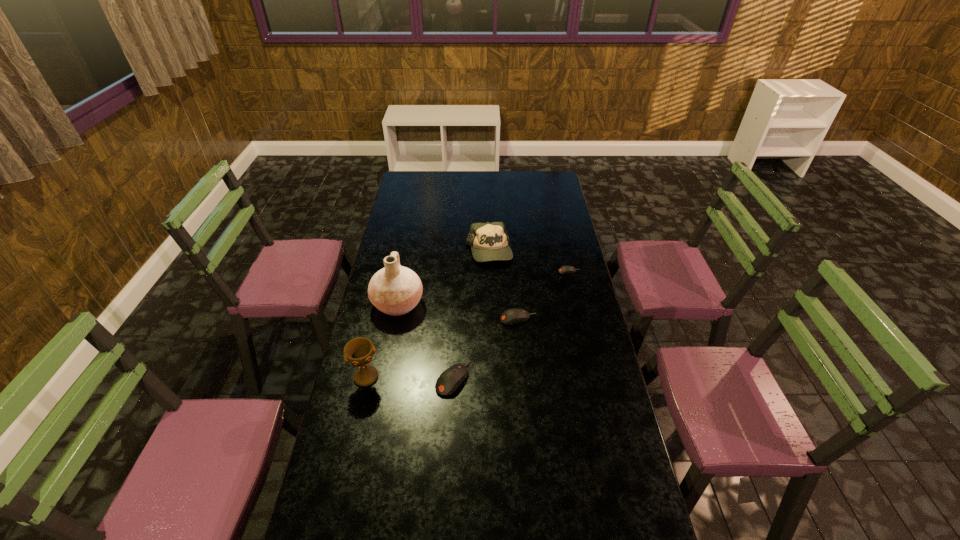
What are the coordinates of `vacant space at the left edge of the desktop` in the screenshot? It's located at (375, 422).

Where is `vacant point at the right edge`? The image size is (960, 540). vacant point at the right edge is located at coordinates click(x=586, y=436).

You are a GUI agent. You are given a task and a screenshot of the screen. Output one action in this format:
    pyautogui.click(x=<x>, y=<y>)
    Task: Click on the vacant space at the near left corner of the desktop
    The height and width of the screenshot is (540, 960).
    Given the screenshot: What is the action you would take?
    pyautogui.click(x=334, y=531)

Locate an element on the screen. This screenshot has width=960, height=540. free point between the nearest computer mouse and the second shortest object is located at coordinates pos(486,348).

This screenshot has width=960, height=540. What are the coordinates of `unoccupied position between the pottery and the leftmost computer mouse` in the screenshot? It's located at (425, 341).

The image size is (960, 540). In order to click on unoccupied area between the fourth shortest object and the nearest computer mouse in this screenshot , I will do `click(471, 315)`.

I want to click on vacant region between the tallest object and the nearest computer mouse, so click(x=425, y=341).

Identify the location of unoccupied area between the chalice and the leftmost computer mouse. The image size is (960, 540). (410, 377).

This screenshot has height=540, width=960. What are the coordinates of `free point between the baseball cap and the nearest computer mouse` in the screenshot? It's located at (471, 315).

Where is `vacant area that lies between the third tallest object and the second computer mouse from right to left`? vacant area that lies between the third tallest object and the second computer mouse from right to left is located at coordinates (503, 285).